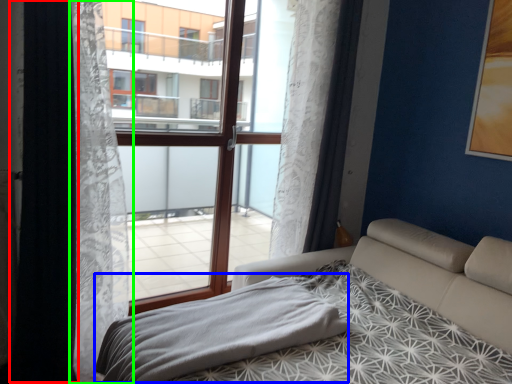
Question: Estimate the real-world distances between objects in this image. Which object is farther from curtain (highlighted by a red box), blanket (highlighted by a blue box) or curtain (highlighted by a green box)?

Choices:
 (A) blanket
 (B) curtain

Answer: (A)